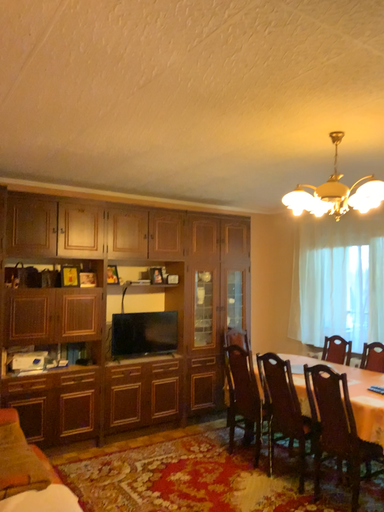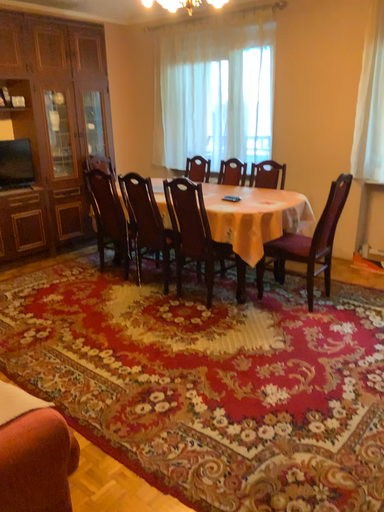
Question: Which way did the camera rotate in the video?

Choices:
 (A) rotated right
 (B) rotated left

Answer: (A)